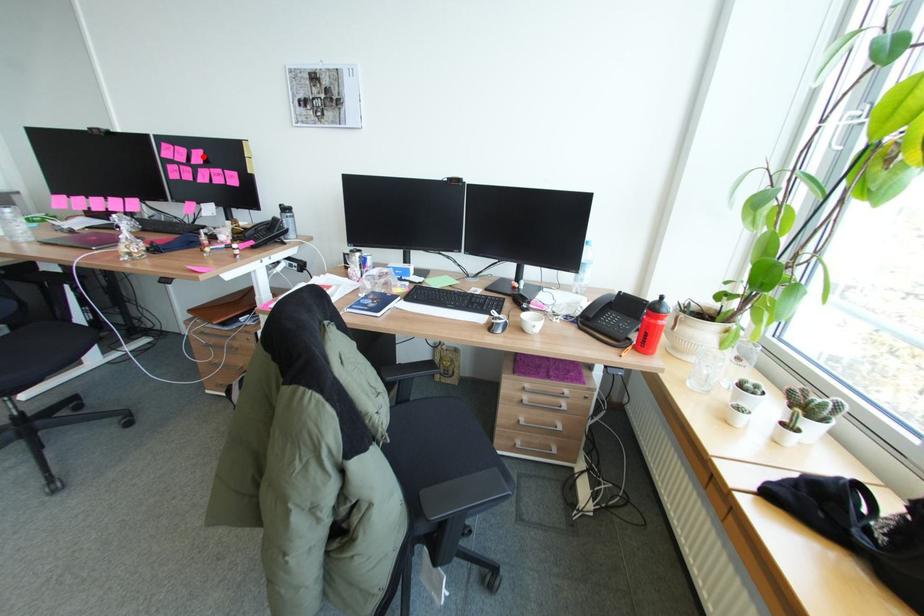
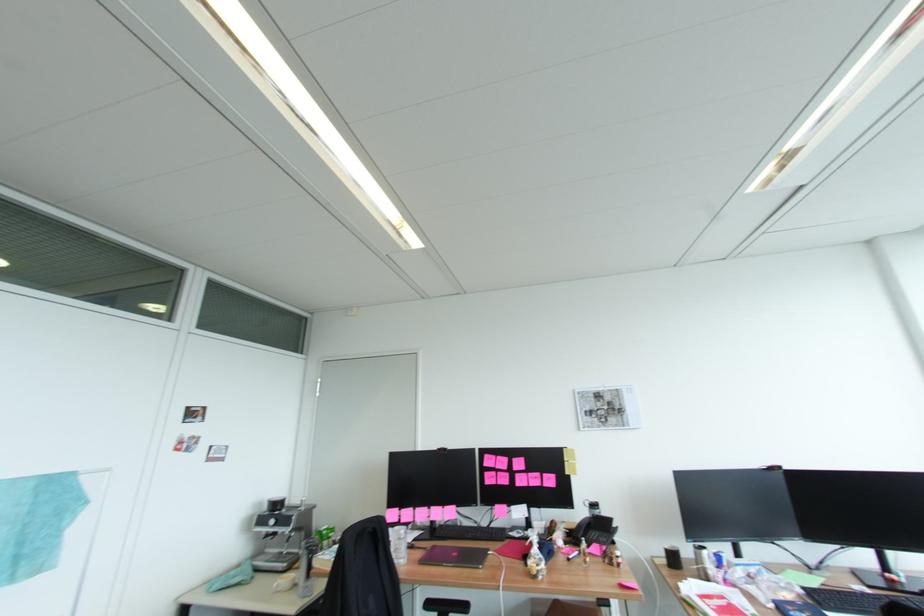
Where in the second image is the point corresponding to the highlighted location from the first image?

(524, 463)